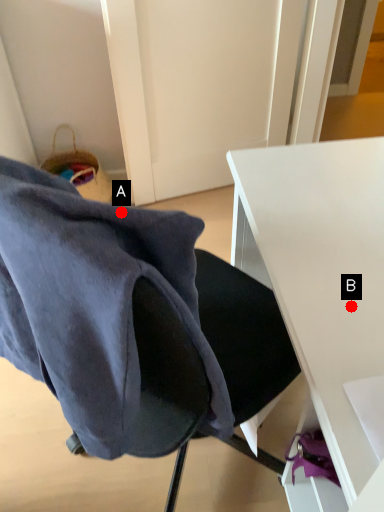
Question: Two points are circled on the image, labeled by A and B beside each circle. Which of the following is the closest to the observer?

Choices:
 (A) A is closer
 (B) B is closer

Answer: (A)